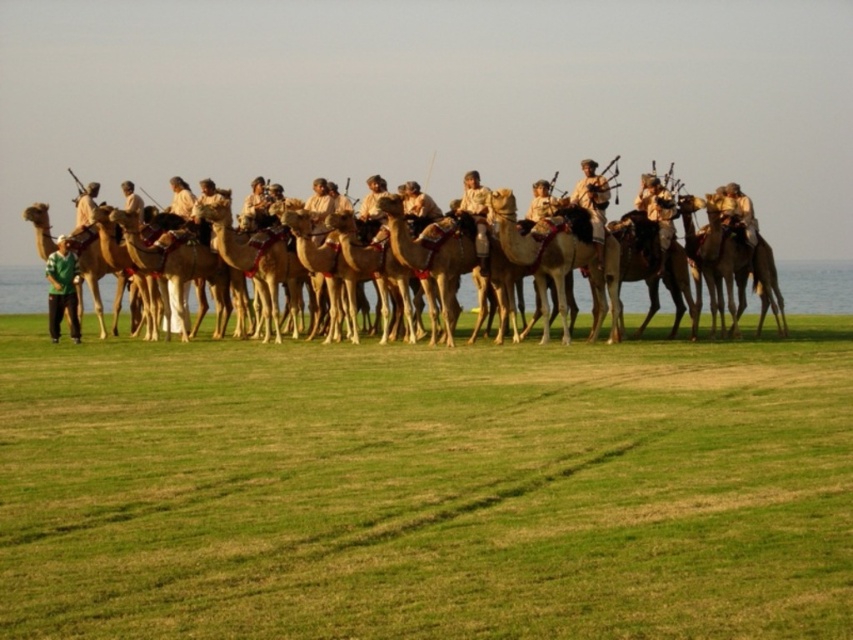
Does green grass at lower center lie behind green matte shirt at lower left?

No, it is in front of green matte shirt at lower left.

Find the location of `green grass at lower center`. green grass at lower center is located at coordinates (425, 490).

Image resolution: width=853 pixels, height=640 pixels. In order to click on green grass at lower center in this screenshot , I will do `click(425, 490)`.

Which of these two, green grass at lower center or light brown camel at center, stands shorter?

With less height is green grass at lower center.

Is green grass at lower center further to the viewer compared to light brown camel at center?

That is False.

Is point (160, 460) positioned after point (628, 230)?

No, (160, 460) is in front of (628, 230).

At what (x,y) coordinates should I click in order to perform the action: click on green grass at lower center. Please return your answer as a coordinate pair (x, y). Looking at the image, I should click on (425, 490).

Can you confirm if light brown leather camel at left is positioned below light brown fabric at center?

Indeed, light brown leather camel at left is positioned under light brown fabric at center.

Does light brown leather camel at left have a lesser width compared to light brown fabric at center?

Incorrect, light brown leather camel at left's width is not less than light brown fabric at center's.

Image resolution: width=853 pixels, height=640 pixels. What are the coordinates of `light brown leather camel at left` in the screenshot? It's located at (85, 205).

The image size is (853, 640). Find the location of `light brown leather camel at left`. light brown leather camel at left is located at coordinates (85, 205).